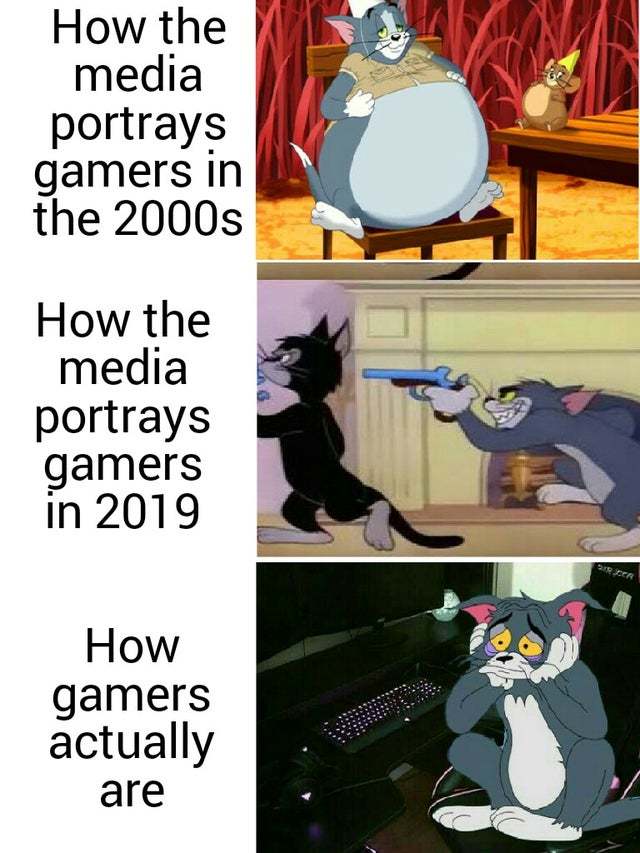
I want to click on monitors, so click(340, 589), click(259, 631).